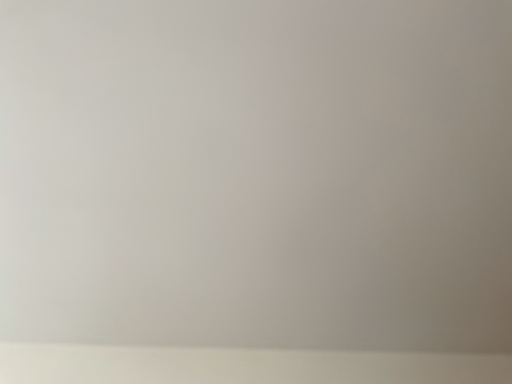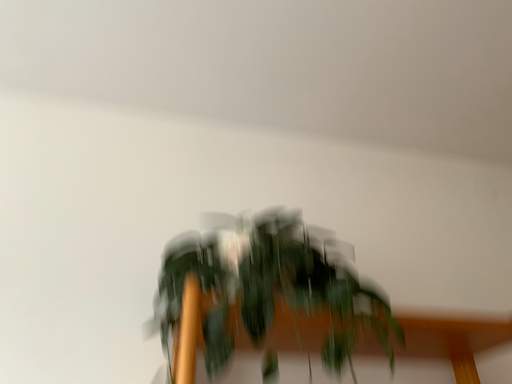
Question: Which way did the camera rotate in the video?

Choices:
 (A) rotated upward
 (B) rotated downward

Answer: (B)